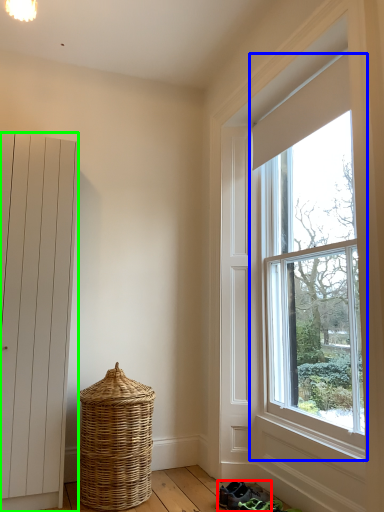
Question: Which is farther away from footwear (highlighted by a red box)? window (highlighted by a blue box) or door (highlighted by a green box)?

Choices:
 (A) window
 (B) door

Answer: (B)